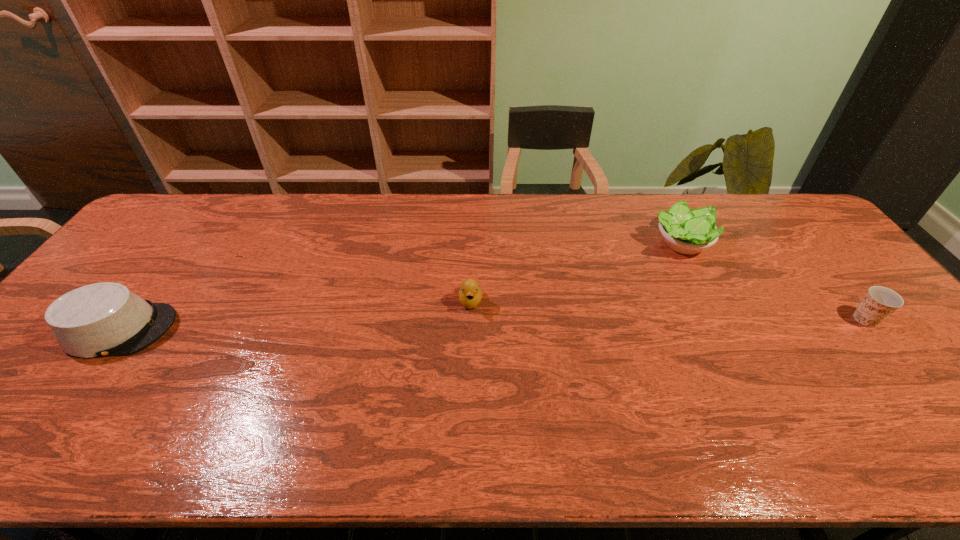
This screenshot has height=540, width=960. Identify the location of object situated at the left edge. click(x=105, y=319).

Locate an element on the screen. object that is at the right edge is located at coordinates (880, 302).

In the image, there is a desktop. At what (x,y) coordinates should I click in order to perform the action: click on vacant area at the far edge. Please return your answer as a coordinate pair (x, y). This screenshot has height=540, width=960. Looking at the image, I should click on (300, 211).

The image size is (960, 540). I want to click on vacant space at the near edge, so click(x=116, y=451).

At what (x,y) coordinates should I click in order to perform the action: click on free point between the third object from right to left and the farthest object. Please return your answer as a coordinate pair (x, y). Looking at the image, I should click on (575, 272).

Identify the location of unoccupied area between the farthest object and the hat. The image size is (960, 540). (400, 286).

What are the coordinates of `unoccupied area between the lettuce and the leftmost object` in the screenshot? It's located at click(400, 286).

The image size is (960, 540). In order to click on vacant space that's between the rightmost object and the leftmost object in this screenshot , I will do `click(493, 324)`.

Image resolution: width=960 pixels, height=540 pixels. I want to click on free space between the second object from right to left and the Dixie cup, so click(773, 281).

This screenshot has width=960, height=540. Find the location of `free space between the Dixie cup and the farthest object`. free space between the Dixie cup and the farthest object is located at coordinates (773, 281).